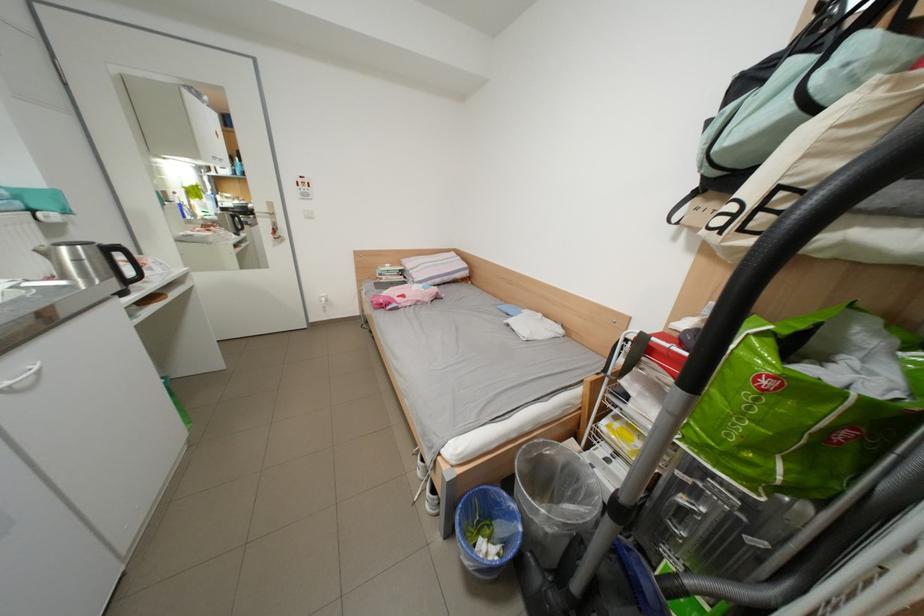
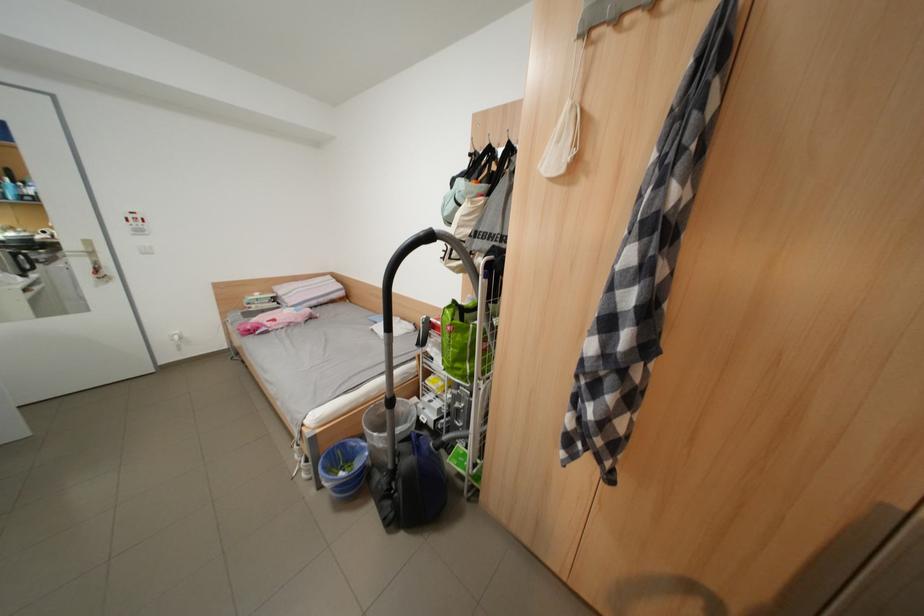
Locate, in the second image, the point that corresponds to pixel 754 448 in the first image.

(466, 363)